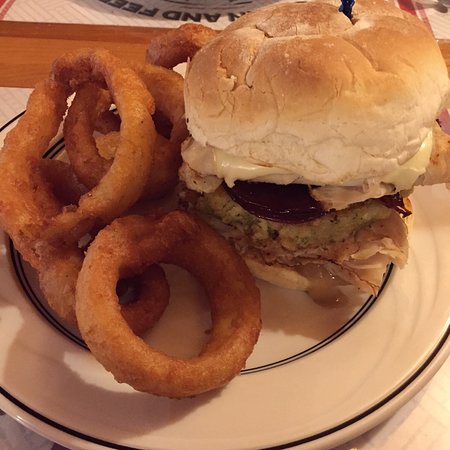
Locate an element on the screen. The height and width of the screenshot is (450, 450). table between placemats is located at coordinates (18, 66).